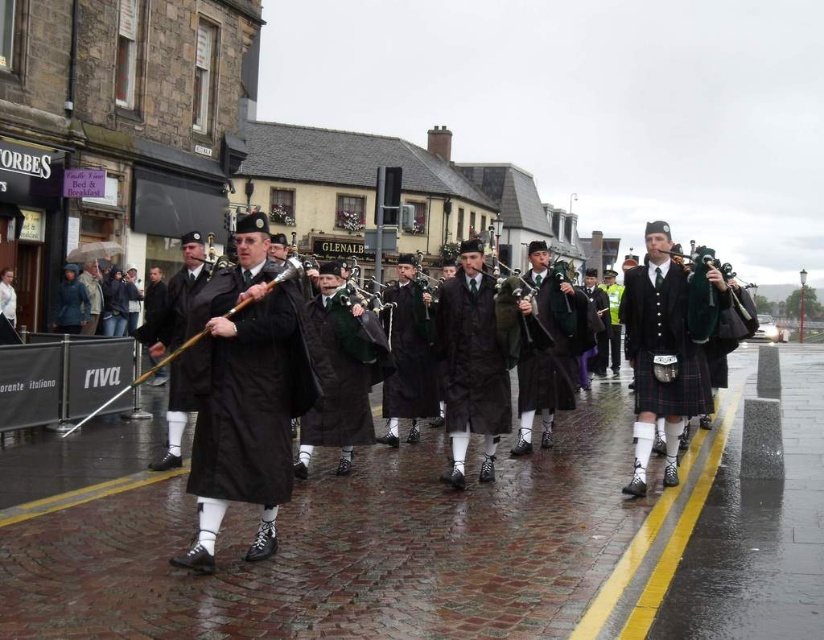
Between matte black kilt at center and plaid fabric kilt at right, which one has less height?

matte black kilt at center

Where is `matte black kilt at center`? matte black kilt at center is located at coordinates (246, 394).

Between point (372, 424) and point (190, 344), which one is positioned in front?

Point (190, 344) is more forward.

Is green woolen kilt at center positioned in front of wooden bagpipe at center?

No, it is not.

Where is `green woolen kilt at center`? The image size is (824, 640). green woolen kilt at center is located at coordinates (336, 380).

Between green leather bagpipe at center and wooden bagpipe at center, which one has less height?

wooden bagpipe at center

Locate an element on the screen. This screenshot has width=824, height=640. green leather bagpipe at center is located at coordinates (511, 307).

The width and height of the screenshot is (824, 640). I want to click on green leather bagpipe at center, so click(511, 307).